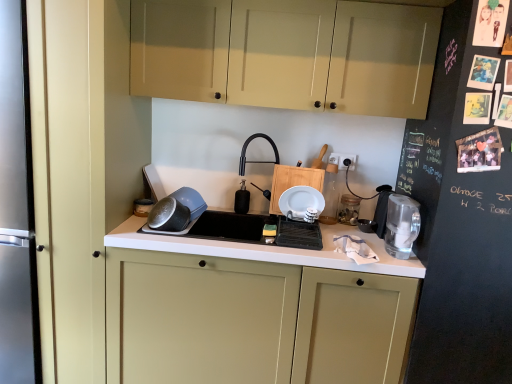
Identify the location of matte black kettle at right, which appears as the 1th appliance when viewed from the right. Image resolution: width=512 pixels, height=384 pixels. (366, 225).

The width and height of the screenshot is (512, 384). What do you see at coordinates (459, 228) in the screenshot?
I see `black chalkboard at right` at bounding box center [459, 228].

Find the location of a particular element. The width and height of the screenshot is (512, 384). black matte faucet at center is located at coordinates (256, 161).

Describe the element at coordinates (349, 209) in the screenshot. I see `translucent glass jar at upper right, placed as the second appliance when sorted from right to left` at that location.

Identify the location of white plastic electric outlet at upper right. The image size is (512, 384). (343, 160).

Does point (244, 179) appear closer or farther from the camera than point (371, 228)?

Point (244, 179) is farther from the camera than point (371, 228).

Is black matte soap dispenser at center, which is the 3th appliance from right to left, placed right next to matte black kettle at right, which appears as the 1th appliance when viewed from the right?

No.

Find the location of a particular element. appliance that is the 3rd one when counting downward from the black matte soap dispenser at center, which is the 3th appliance from right to left (from the image's perspective) is located at coordinates (366, 225).

In terms of width, does black matte soap dispenser at center, which is the 3th appliance from right to left, look wider or thinner when compared to matte black kettle at right, which appears as the 1th appliance when viewed from the right?

Clearly, black matte soap dispenser at center, which is the 3th appliance from right to left, has less width compared to matte black kettle at right, which appears as the 1th appliance when viewed from the right.

Does matte black kettle at right, the fourth appliance from the left, turn towards matte plastic bowl at center?

No, matte black kettle at right, the fourth appliance from the left, is not turned towards matte plastic bowl at center.

From a real-world perspective, who is located higher, matte black kettle at right, which appears as the 1th appliance when viewed from the right, or matte plastic bowl at center?

From a 3D spatial view, matte plastic bowl at center is above.

In terms of width, does matte black kettle at right, which appears as the 1th appliance when viewed from the right, look wider or thinner when compared to matte plastic bowl at center?

Clearly, matte black kettle at right, which appears as the 1th appliance when viewed from the right, has less width compared to matte plastic bowl at center.

I want to click on kitchen appliance above the matte black kettle at right, which appears as the 1th appliance when viewed from the right (from the image's perspective), so click(176, 210).

From a real-world perspective, relative to matte cream cabinet at center, the first cabinetry from the bottom, is black chalkboard at right vertically above or below?

From a real-world perspective, black chalkboard at right is physically above matte cream cabinet at center, the first cabinetry from the bottom.

Can you see black chalkboard at right touching matte cream cabinet at center, positioned as the second cabinetry in top-to-bottom order?

No, black chalkboard at right is not in contact with matte cream cabinet at center, positioned as the second cabinetry in top-to-bottom order.

From the picture: Considering the relative sizes of black chalkboard at right and matte cream cabinet at center, the first cabinetry from the bottom, in the image provided, is black chalkboard at right thinner than matte cream cabinet at center, the first cabinetry from the bottom,?

Incorrect, the width of black chalkboard at right is not less than that of matte cream cabinet at center, the first cabinetry from the bottom.

Is black chalkboard at right located outside matte cream cabinet at center, positioned as the second cabinetry in top-to-bottom order?

Absolutely, black chalkboard at right is external to matte cream cabinet at center, positioned as the second cabinetry in top-to-bottom order.

Can you see matte cream cabinet at center, the first cabinetry from the bottom, touching black matte soap dispenser at center, marked as the second appliance in a left-to-right arrangement?

No, matte cream cabinet at center, the first cabinetry from the bottom, is not touching black matte soap dispenser at center, marked as the second appliance in a left-to-right arrangement.

This screenshot has width=512, height=384. Find the location of `cabinetry that appears below the black matte soap dispenser at center, marked as the second appliance in a left-to-right arrangement (from a real-world perspective)`. cabinetry that appears below the black matte soap dispenser at center, marked as the second appliance in a left-to-right arrangement (from a real-world perspective) is located at coordinates (251, 321).

From a real-world perspective, between matte cream cabinet at center, the first cabinetry from the bottom, and black matte soap dispenser at center, marked as the second appliance in a left-to-right arrangement, who is vertically lower?

From a 3D spatial view, matte cream cabinet at center, the first cabinetry from the bottom, is below.

Does point (380, 325) come closer to viewer compared to point (242, 201)?

Yes.

Considering the positions of points (248, 138) and (343, 163), is point (248, 138) farther from camera compared to point (343, 163)?

Yes, it is.

From a real-world perspective, between black matte faucet at center and white plastic electric outlet at upper right, who is vertically higher?

From a 3D spatial view, white plastic electric outlet at upper right is above.

In order to click on faucet below the white plastic electric outlet at upper right (from a real-world perspective) in this screenshot , I will do `click(256, 161)`.

Is matte black kettle at right, the fourth appliance from the left, oriented towards black chalkboard at right?

No, matte black kettle at right, the fourth appliance from the left, is not turned towards black chalkboard at right.

Is matte black kettle at right, which appears as the 1th appliance when viewed from the right, in front of black chalkboard at right?

No, matte black kettle at right, which appears as the 1th appliance when viewed from the right, is behind black chalkboard at right.

From a real-world perspective, is matte black kettle at right, the fourth appliance from the left, positioned above or below black chalkboard at right?

matte black kettle at right, the fourth appliance from the left, is situated lower than black chalkboard at right in the real world.

How many degrees apart are the facing directions of matte black kettle at right, which appears as the 1th appliance when viewed from the right, and black chalkboard at right?

0.000652 degrees.

Is point (147, 207) positioned before point (391, 211)?

No, (147, 207) is behind (391, 211).

Does matte black container at left, the fourth appliance when ordered from right to left, have a lesser width compared to clear glass water filter at right?

Incorrect, the width of matte black container at left, the fourth appliance when ordered from right to left, is not less than that of clear glass water filter at right.

Could you tell me if matte black container at left, the fourth appliance when ordered from right to left, is facing clear glass water filter at right?

No.

From the image's perspective, which appliance is the 3rd one below the black matte soap dispenser at center, which is the 3th appliance from right to left? Please provide its 2D coordinates.

[(366, 225)]

In the image, there is a matte black kettle at right, which appears as the 1th appliance when viewed from the right. Find the location of `kitchen appliance above it (from the image's perspective)`. kitchen appliance above it (from the image's perspective) is located at coordinates point(176,210).

When comparing their distances from clear glass water filter at right, does matte black kettle at right, the fourth appliance from the left, or white plastic electric outlet at upper right seem closer?

matte black kettle at right, the fourth appliance from the left, lies closer to clear glass water filter at right than the other object.

Which object lies further to the anchor point black matte soap dispenser at center, which is the 3th appliance from right to left, matte black kettle at right, the fourth appliance from the left, or black matte faucet at center?

matte black kettle at right, the fourth appliance from the left.

When comparing their distances from translucent glass jar at upper right, placed as the second appliance when sorted from right to left, does matte black kettle at right, which appears as the 1th appliance when viewed from the right, or matte black container at left, the fourth appliance when ordered from right to left, seem further?

matte black container at left, the fourth appliance when ordered from right to left, is further to translucent glass jar at upper right, placed as the second appliance when sorted from right to left.

Which object lies nearer to the anchor point matte plastic bowl at center, white plastic electric outlet at upper right or black matte soap dispenser at center, marked as the second appliance in a left-to-right arrangement?

black matte soap dispenser at center, marked as the second appliance in a left-to-right arrangement, is positioned closer to the anchor matte plastic bowl at center.

Based on their spatial positions, is black chalkboard at right or matte black kettle at right, the fourth appliance from the left, closer to matte cream cabinet at center, the first cabinetry from the bottom?

black chalkboard at right is positioned closer to the anchor matte cream cabinet at center, the first cabinetry from the bottom.

Which object lies further to the anchor point black chalkboard at right, matte black kettle at right, the fourth appliance from the left, or clear glass water filter at right?

Among the two, matte black kettle at right, the fourth appliance from the left, is located further to black chalkboard at right.

Estimate the real-world distances between objects in this image. Which object is closer to black chalkboard at right, black matte faucet at center or matte cream cabinets at upper center, the 1th cabinetry when ordered from top to bottom?

matte cream cabinets at upper center, the 1th cabinetry when ordered from top to bottom, is positioned closer to the anchor black chalkboard at right.

From the image, which object appears to be farther from black matte faucet at center, matte black container at left, the fourth appliance when ordered from right to left, or matte plastic bowl at center?

Based on the image, matte black container at left, the fourth appliance when ordered from right to left, appears to be further to black matte faucet at center.

At what (x,y) coordinates should I click in order to perform the action: click on electric outlet between matte plastic bowl at center and translucent glass jar at upper right, positioned as the third appliance in left-to-right order, in the horizontal direction. Please return your answer as a coordinate pair (x, y). Looking at the image, I should click on (343, 160).

The image size is (512, 384). I want to click on kitchen appliance between matte black container at left, the fourth appliance when ordered from right to left, and matte black kettle at right, the fourth appliance from the left, so click(176, 210).

The image size is (512, 384). What are the coordinates of `cabinetry located between black matte faucet at center and black chalkboard at right in the left-right direction` in the screenshot? It's located at (288, 53).

The image size is (512, 384). What are the coordinates of `appliance between matte plastic bowl at center and white plastic electric outlet at upper right in the horizontal direction` in the screenshot? It's located at (242, 199).